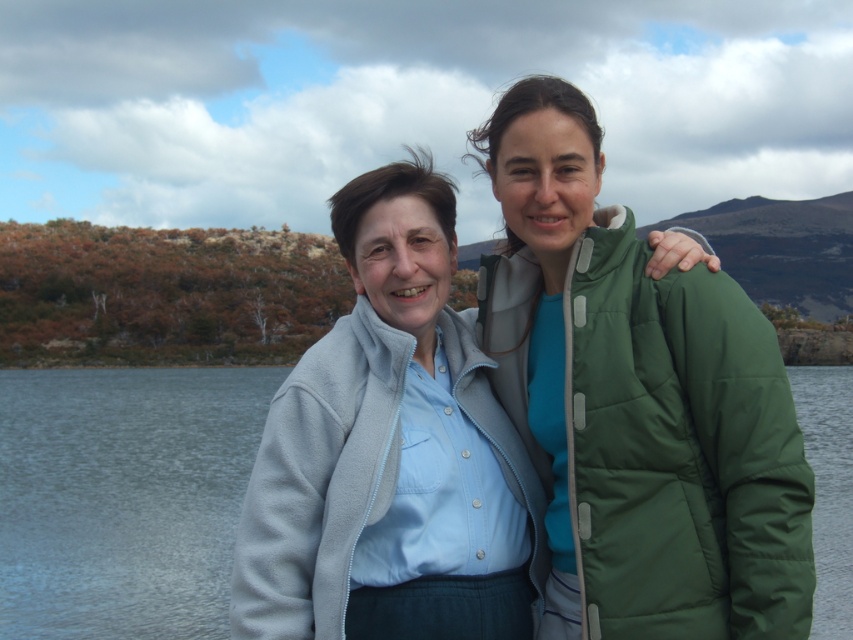
You are a fashion designer observing two jackets in the image. The green puffy jacket at center and the light blue fleece jacket at center. Which one has a longer length?

The light blue fleece jacket at center is taller than the green puffy jacket at center, so the light blue fleece jacket at center has a longer length.

You are a photographer trying to capture the scene with the light blue fleece jacket at center and the transparent water at center. Which object should you focus on first if you want to ensure both are in focus?

The light blue fleece jacket at center is above the transparent water at center, so you should focus on the light blue fleece jacket at center first to ensure both are in focus.